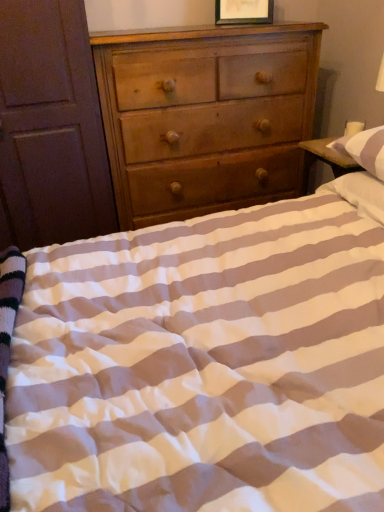
Question: Considering the positions of wooden picture frame at upper center and brown wooden armoire at left in the image, is wooden picture frame at upper center taller or shorter than brown wooden armoire at left?

Choices:
 (A) tall
 (B) short

Answer: (B)

Question: Choose the correct answer: Is wooden picture frame at upper center inside brown wooden armoire at left or outside it?

Choices:
 (A) outside
 (B) inside

Answer: (A)

Question: Considering the real-world distances, which object is farthest from the white striped pillow at upper right?

Choices:
 (A) wooden picture frame at upper center
 (B) light brown wood chest of drawers at center
 (C) brown wooden armoire at left

Answer: (C)

Question: Which is farther from the light brown wood chest of drawers at center?

Choices:
 (A) white striped pillow at upper right
 (B) brown wooden armoire at left
 (C) wooden picture frame at upper center

Answer: (A)